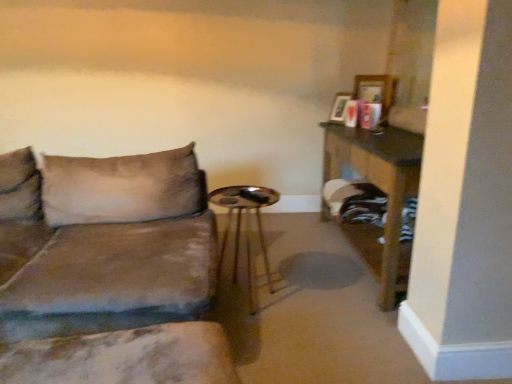
Where is `vacant space to the right of metallic gold side table at center`? vacant space to the right of metallic gold side table at center is located at coordinates (313, 300).